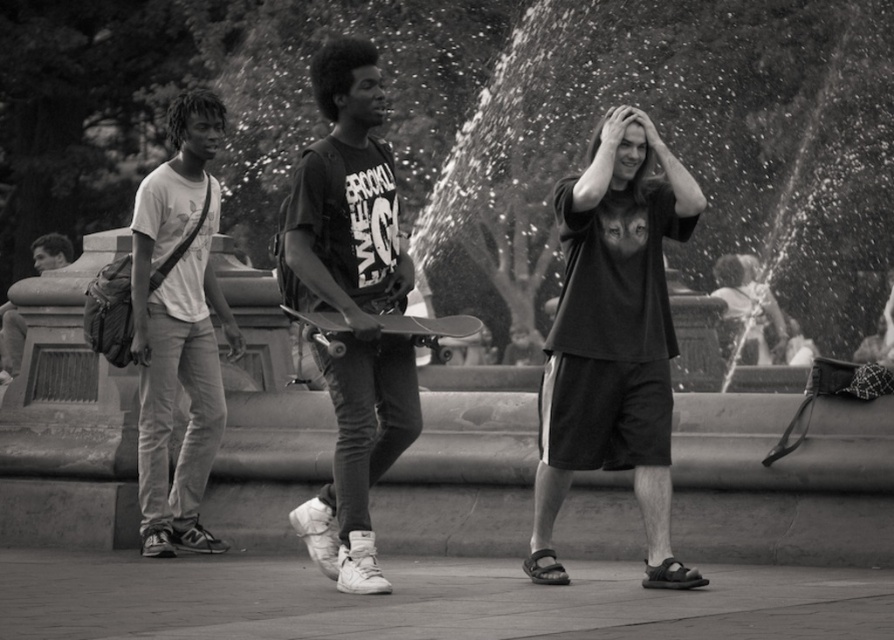
Question: Among these points, which one is nearest to the camera?

Choices:
 (A) (634, 205)
 (B) (343, 333)
 (C) (382, 468)
 (D) (216, 552)

Answer: (B)

Question: Is matte black t-shirt at center to the right of matte black skateboard at center from the viewer's perspective?

Choices:
 (A) no
 (B) yes

Answer: (B)

Question: Estimate the real-world distances between objects in this image. Which object is closer to the matte black t-shirt at center?

Choices:
 (A) light gray cotton pants at left
 (B) smooth black skateboard at center
 (C) matte black skateboard at center

Answer: (B)

Question: Which point appears farthest from the camera in this image?

Choices:
 (A) (x=410, y=433)
 (B) (x=330, y=348)
 (C) (x=688, y=579)
 (D) (x=148, y=196)

Answer: (D)

Question: Does light gray cotton pants at left have a lesser width compared to smooth black skateboard at center?

Choices:
 (A) no
 (B) yes

Answer: (B)

Question: Does matte black skateboard at center have a greater width compared to light gray cotton pants at left?

Choices:
 (A) yes
 (B) no

Answer: (A)